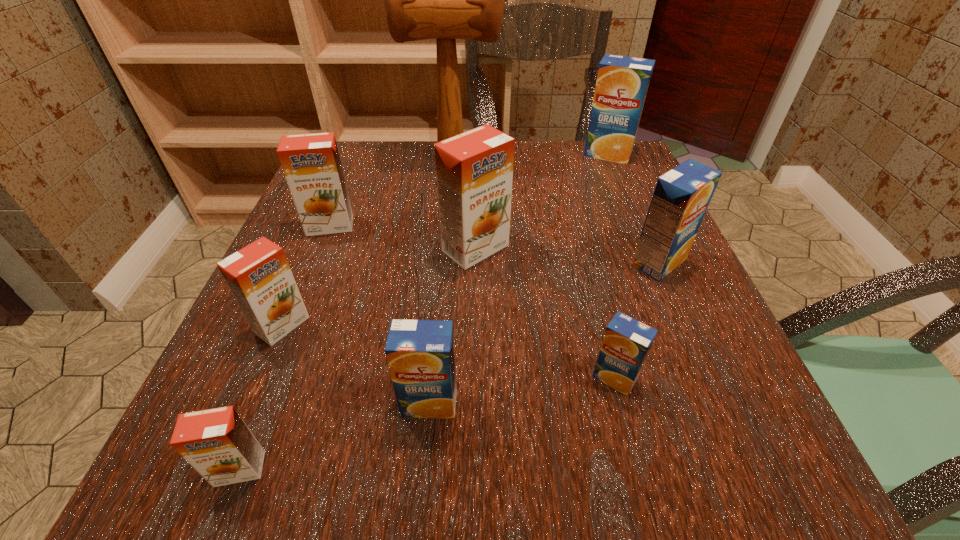
Where is `mallet`? The height and width of the screenshot is (540, 960). mallet is located at coordinates (445, 0).

At what (x,y) coordinates should I click in order to perform the action: click on the farthest orange juice. Please return your answer as a coordinate pair (x, y). The width and height of the screenshot is (960, 540). Looking at the image, I should click on pos(622,82).

Identify the location of the farthest blue orange_juice. The image size is (960, 540). (622, 82).

Identify the location of the rightmost orange orange juice. (474, 169).

Locate an element on the screen. This screenshot has width=960, height=540. the second farthest blue orange_juice is located at coordinates (681, 197).

Find the location of a particular element. the second biggest orange orange juice is located at coordinates (311, 163).

Find the location of `the sixth farthest object`. the sixth farthest object is located at coordinates (259, 276).

In order to click on the third farthest orange orange juice in this screenshot , I will do `click(259, 276)`.

Identify the location of the second smallest blue orange_juice. (420, 353).

The image size is (960, 540). I want to click on the second blue orange_juice from left to right, so click(626, 343).